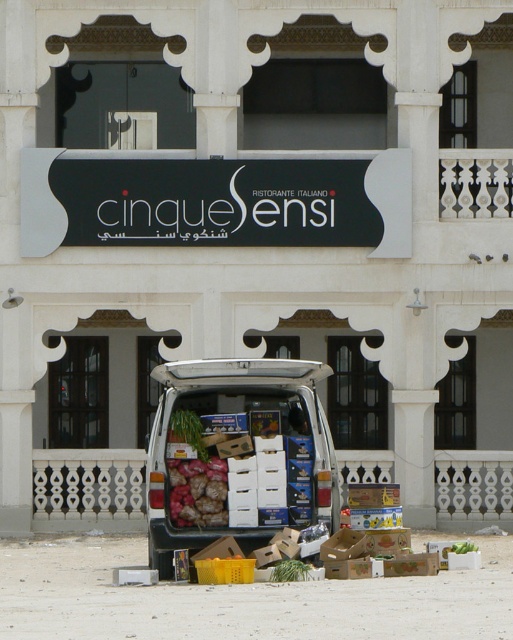
Where is `white cardboard minivan at center`? The height and width of the screenshot is (640, 513). white cardboard minivan at center is located at coordinates (240, 458).

Where is `white cardboard minivan at center`? Image resolution: width=513 pixels, height=640 pixels. white cardboard minivan at center is located at coordinates (240, 458).